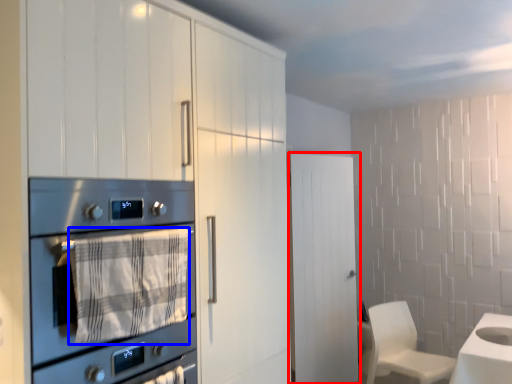
Question: Which of the following is the farthest to the observer, door (highlighted by a red box) or blanket (highlighted by a blue box)?

Choices:
 (A) door
 (B) blanket

Answer: (A)